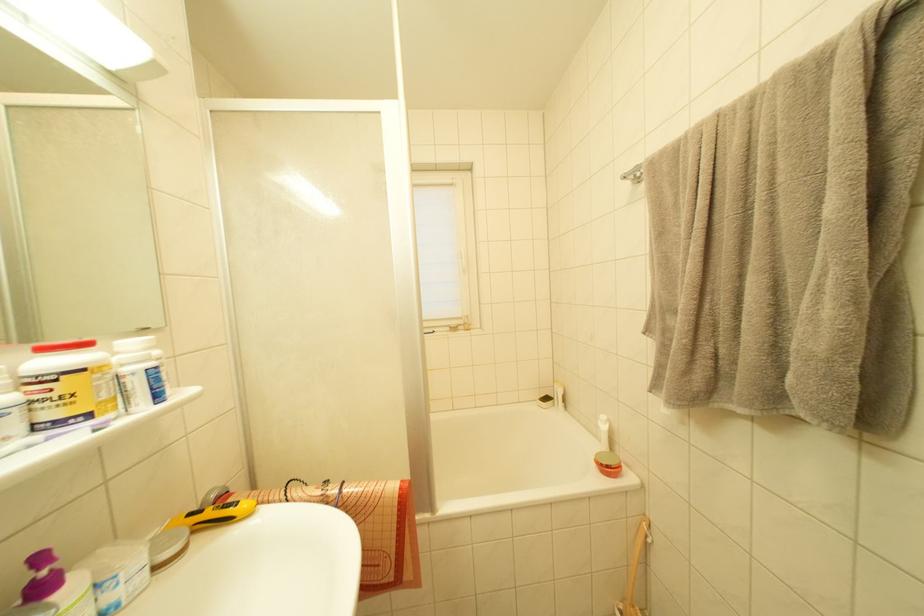
Where would you grasp the long-handled brush? Please return your answer as a coordinate pair (x, y).

(634, 570)